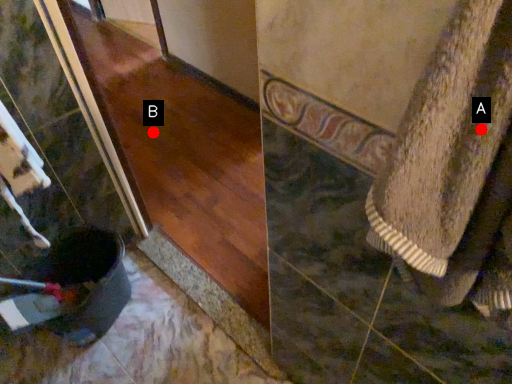
Question: Two points are circled on the image, labeled by A and B beside each circle. Which point is farther from the camera taking this photo?

Choices:
 (A) A is further
 (B) B is further

Answer: (B)